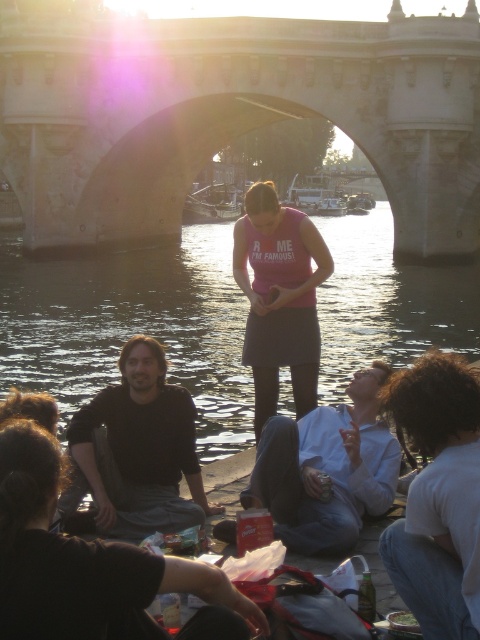
You are standing on the riverbank and see the dark water at center and the pink matte skirt at center. Which object is positioned to the right of the other?

The dark water at center is to the right of the pink matte skirt at center.

You are standing on the riverbank and want to cross to the other side. The stone bridge at center is your only option. Is the bridge directly in front of you, or do you need to walk left or right to reach it?

The stone bridge at center is located at point 0.180 on the horizontal axis, which means it is slightly to the left of the center. Therefore, you would need to walk slightly to your left to reach it.

You are standing on the riverbank and want to cross the river to the other side. The stone bridge at center and dark water at center are in your view. Which one should you use to cross the river?

The stone bridge at center is located above dark water at center, so you should use the stone bridge at center to cross the river safely instead of walking on the dark water at center.